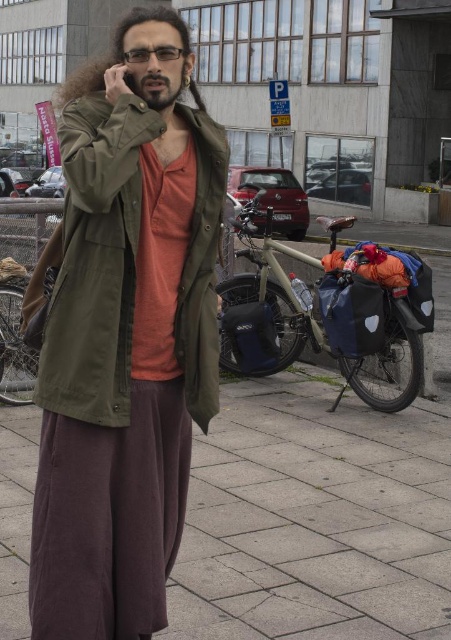
You are a delivery person who needs to place a package on the ground. You are currently standing on the gray concrete pavement at center and holding the olive green fabric jacket at center. Can you safely place the package on the pavement without it being too close to the jacket?

The gray concrete pavement at center is 5.76 feet from the olive green fabric jacket at center. Since the distance is sufficient, you can safely place the package on the pavement without it being too close to the jacket.

You are standing at the point labeled as point (314, 516) in the image. What material are you standing on?

The point (314, 516) corresponds to gray concrete pavement at center, so you are standing on concrete.